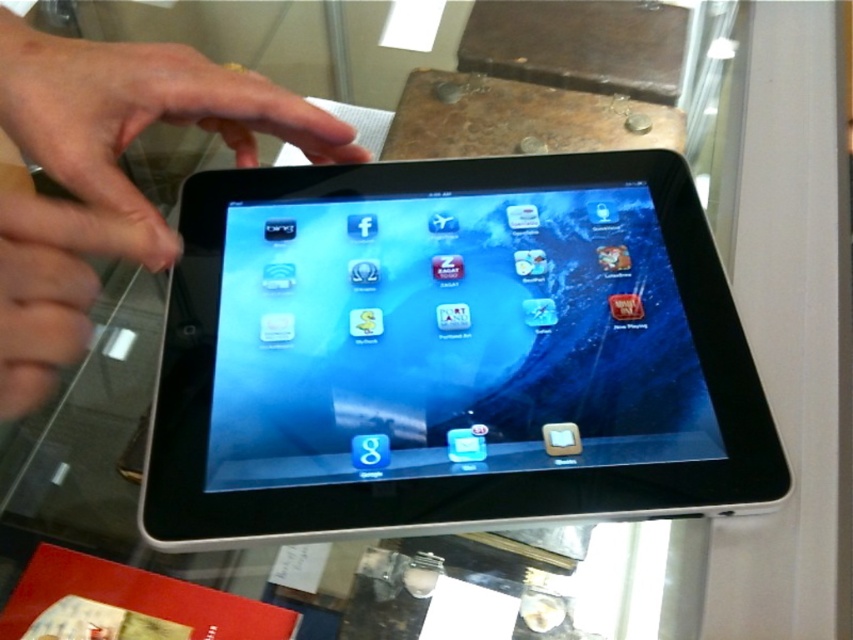
You are a customer in an electronics store and see two tablets displayed on the same glass surface. The black glossy tablet at center and the matte black tablet at center. Which one has a bigger screen?

The black glossy tablet at center has a bigger screen than the matte black tablet at center.

You are a customer in an electronics store looking at two tablets displayed on a glass surface. You see the black glossy tablet at center and the matte black tablet at center. Which one is positioned to the right side?

The black glossy tablet at center is positioned to the right of the matte black tablet at center.